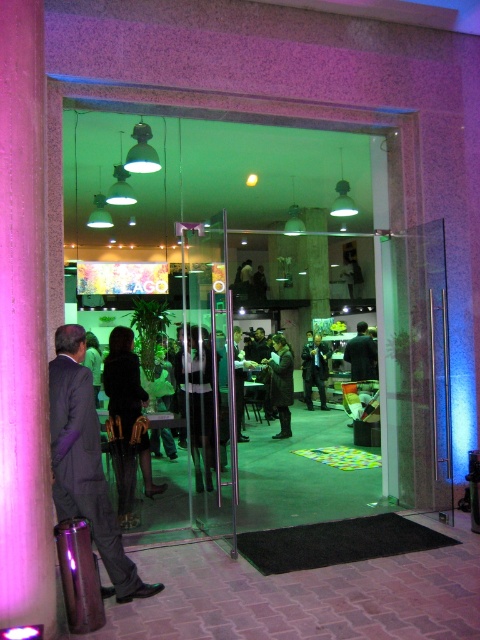
You are a guest arriving at the entrance. You see a matte black suit at left and a dark brown leather jacket at center. Which one is closer to you as you face the entrance?

The matte black suit at left is closer to you because it is in front of the dark brown leather jacket at center.

You are a person standing at the entrance of the modern interior space. You want to greet someone wearing the dark suit at center and the dark green fabric jacket at center. Can you walk directly between them to reach both without needing to detour around either?

The dark suit at center is 1.74 meters away from the dark green fabric jacket at center. Since the distance between them is over 1.5 meters, you can easily walk between them to greet both without needing to detour.

You are a delivery person standing at the entrance of the modern interior space. You need to deliver a package to the person wearing the matte black suit at left and then to the person wearing the dark brown leather jacket at center. Can you walk directly from one to the other without moving around any obstacles?

The distance between the matte black suit at left and the dark brown leather jacket at center is 18.13 feet. Since there are no obstacles mentioned in the scene description, you can walk directly between them.